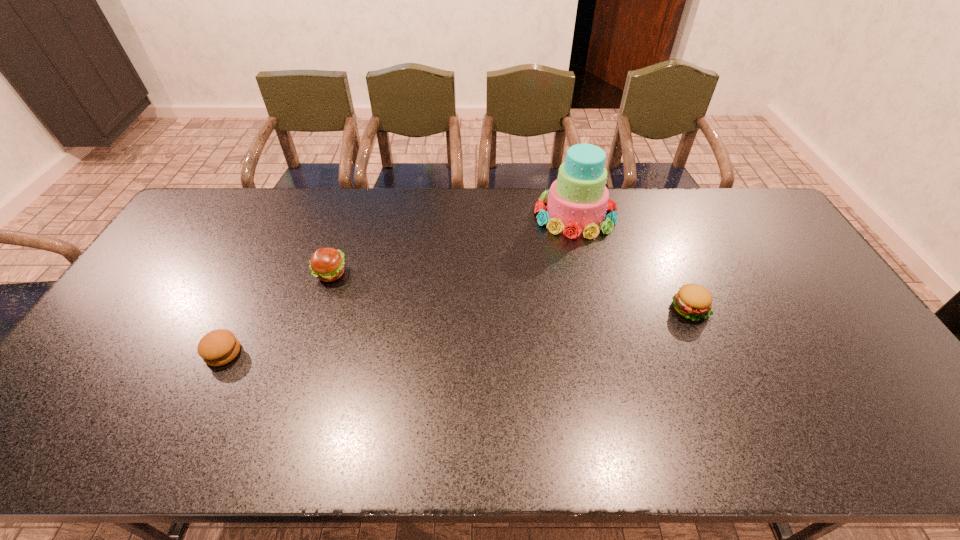
Identify the location of the farthest object. Image resolution: width=960 pixels, height=540 pixels. (578, 199).

At what (x,y) coordinates should I click in order to perform the action: click on the tallest object. Please return your answer as a coordinate pair (x, y). This screenshot has height=540, width=960. Looking at the image, I should click on (578, 199).

Where is `the third nearest object`? The width and height of the screenshot is (960, 540). the third nearest object is located at coordinates (327, 264).

Find the location of a particular element. This screenshot has height=540, width=960. the third object from right to left is located at coordinates (327, 264).

Where is `the second tallest hamburger`? The width and height of the screenshot is (960, 540). the second tallest hamburger is located at coordinates (692, 301).

The width and height of the screenshot is (960, 540). Find the location of `the second nearest object`. the second nearest object is located at coordinates (692, 301).

In order to click on the leftmost hamburger in this screenshot , I will do `click(218, 347)`.

Locate an element on the screen. The image size is (960, 540). the nearest hamburger is located at coordinates (218, 347).

Locate an element on the screen. This screenshot has height=540, width=960. vacant space located on the right of the second object from right to left is located at coordinates (650, 214).

Where is `free space located on the front of the second farthest object`? The image size is (960, 540). free space located on the front of the second farthest object is located at coordinates (289, 398).